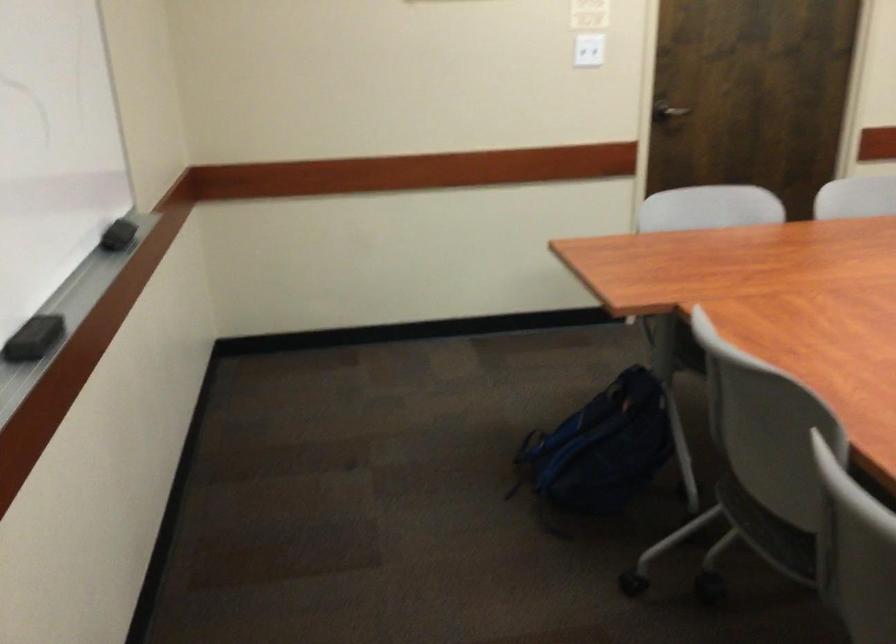
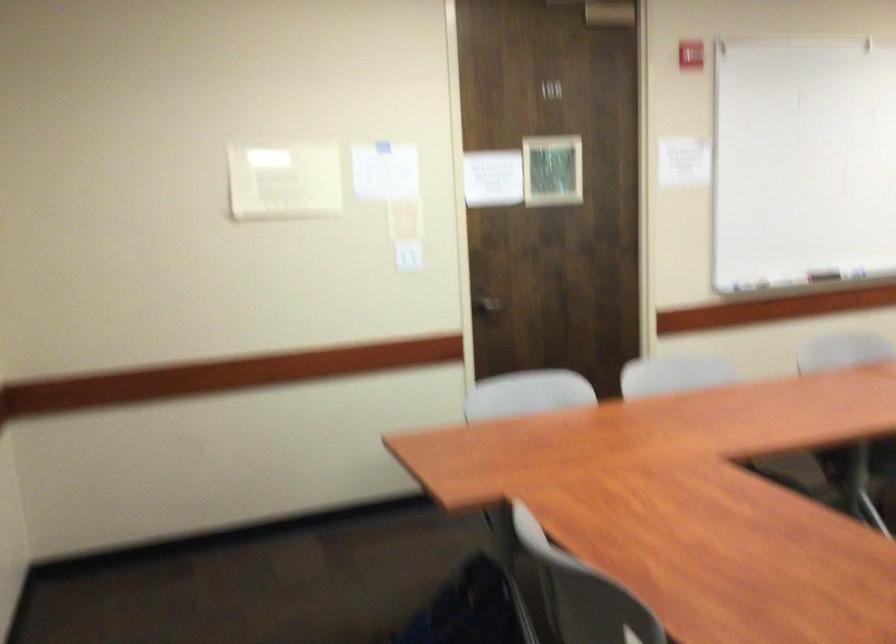
In a continuous first-person perspective shot, in which direction is the camera moving?

The cameraman moved toward right, backward.